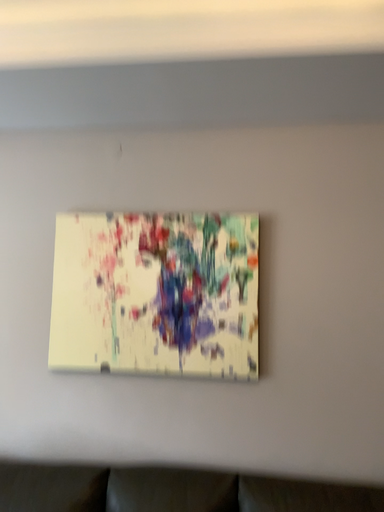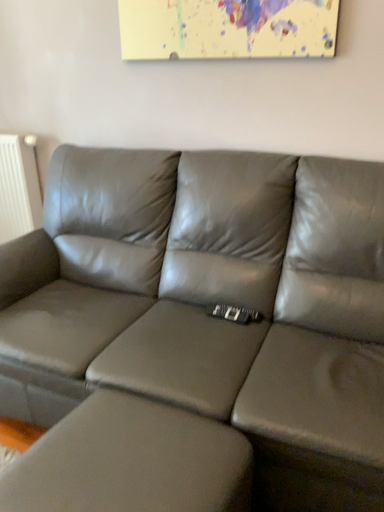
Question: How did the camera likely rotate when shooting the video?

Choices:
 (A) rotated downward
 (B) rotated upward

Answer: (A)